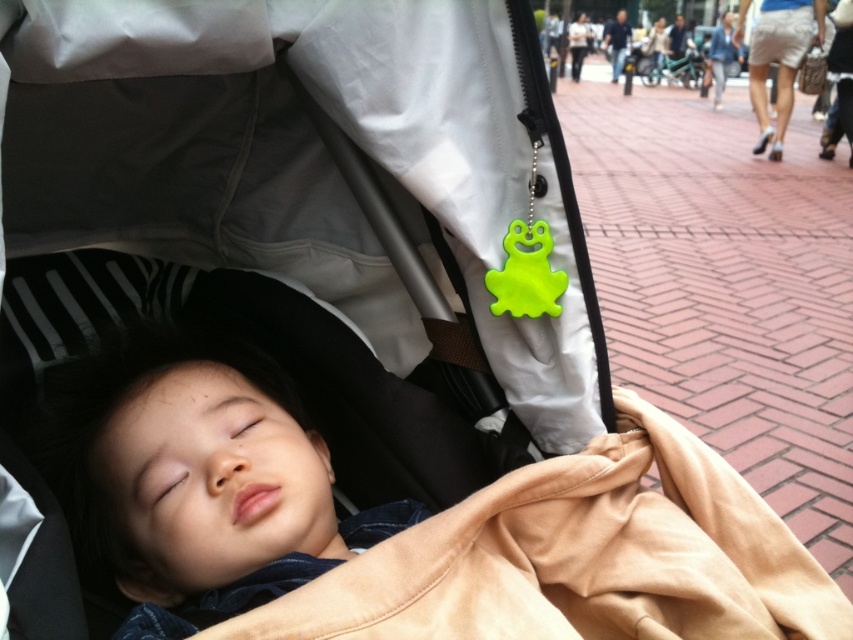
Question: Does matte gray baby carriage at center come in front of smooth skin child at center?

Choices:
 (A) no
 (B) yes

Answer: (B)

Question: Which object is farther from the camera taking this photo?

Choices:
 (A) smooth beige blanket at center
 (B) smooth skin child at center

Answer: (B)

Question: Which point appears closest to the camera in this image?

Choices:
 (A) (344, 38)
 (B) (463, 538)

Answer: (A)

Question: Which object is positioned farthest from the smooth beige blanket at center?

Choices:
 (A) matte gray baby carriage at center
 (B) smooth skin child at center

Answer: (A)

Question: Can you confirm if matte gray baby carriage at center is thinner than smooth skin child at center?

Choices:
 (A) no
 (B) yes

Answer: (A)

Question: Is matte gray baby carriage at center to the left of smooth skin child at center from the viewer's perspective?

Choices:
 (A) no
 (B) yes

Answer: (A)